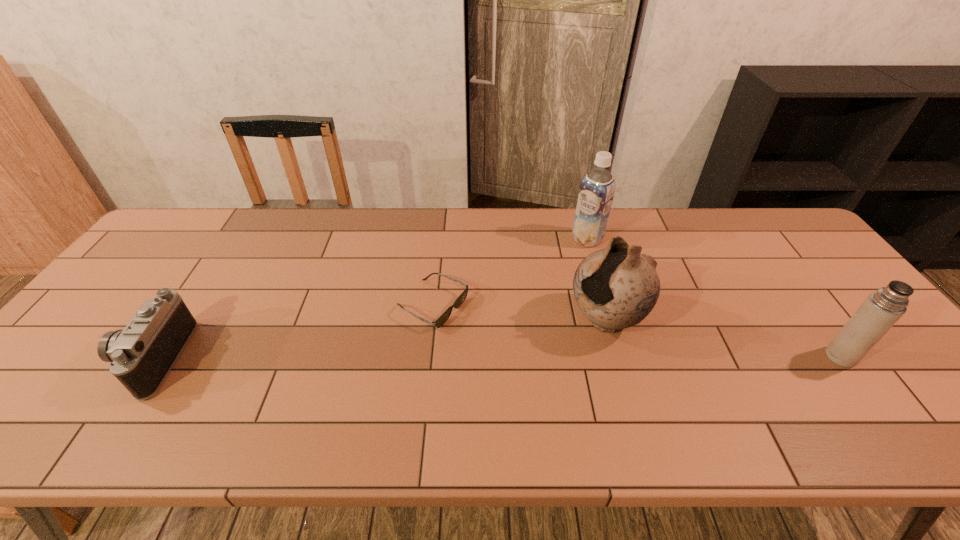
What are the coordinates of `the fourth tallest object` in the screenshot? It's located at (141, 356).

Where is `the leftmost object`? This screenshot has height=540, width=960. the leftmost object is located at coordinates (141, 356).

Identify the location of the rightmost object. (883, 308).

The image size is (960, 540). I want to click on thermos bottle, so (x=883, y=308).

Locate an element on the screen. Image resolution: width=960 pixels, height=540 pixels. the shortest object is located at coordinates (443, 318).

At what (x,y) coordinates should I click in order to perform the action: click on the second object from left to right. Please return your answer as a coordinate pair (x, y). Looking at the image, I should click on (443, 318).

You are a GUI agent. You are given a task and a screenshot of the screen. Output one action in this format:
    pyautogui.click(x=<x>, y=<y>)
    Task: Click on the pottery
    The image size is (960, 540).
    Given the screenshot: What is the action you would take?
    pyautogui.click(x=617, y=287)

Where is `soya milk`? The width and height of the screenshot is (960, 540). soya milk is located at coordinates (596, 193).

The image size is (960, 540). Find the location of `blank area located on the front-facing side of the leftmost object`. blank area located on the front-facing side of the leftmost object is located at coordinates [68, 359].

The height and width of the screenshot is (540, 960). I want to click on free space located 0.170m on the front-facing side of the leftmost object, so [56, 359].